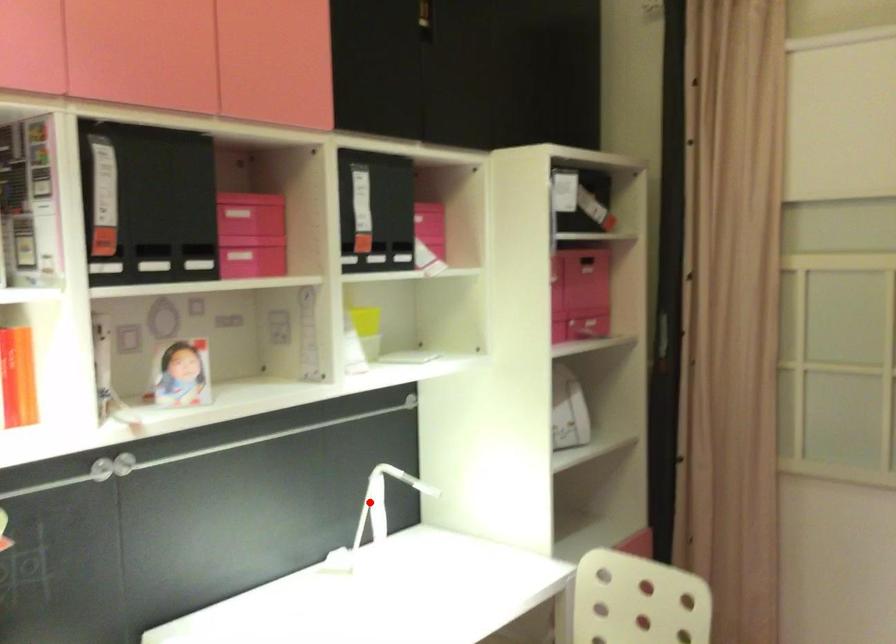
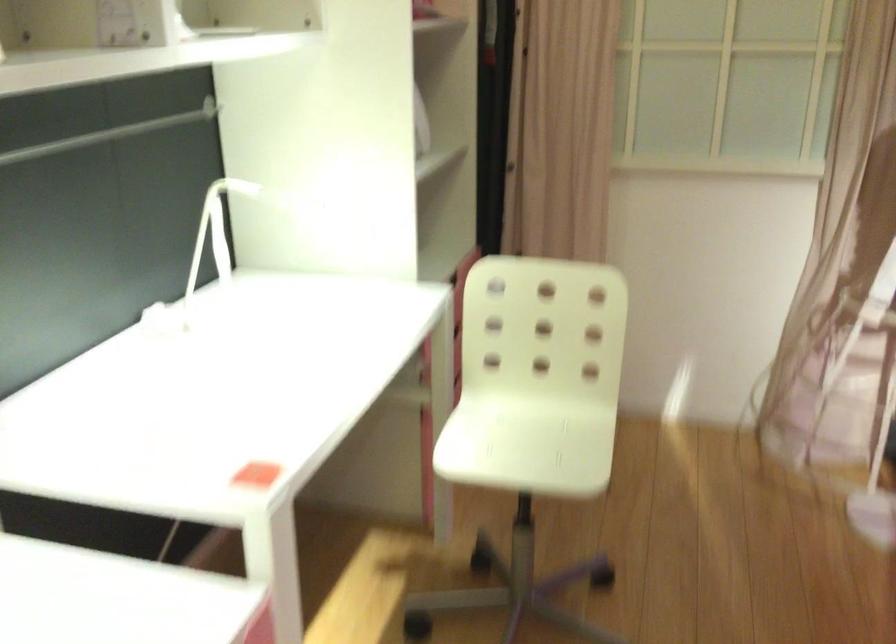
The point at the highlighted location is marked in the first image. Where is the corresponding point in the second image?

(213, 234)